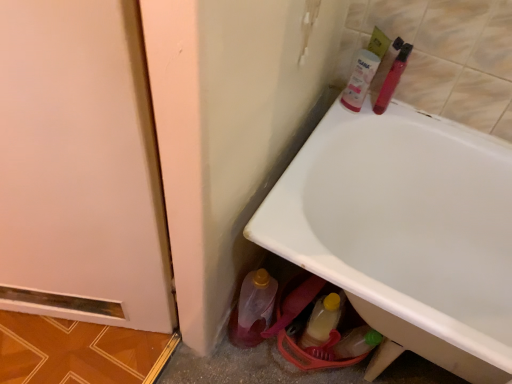
Question: Can you confirm if translucent plastic bottle at lower center, the second bottle viewed from the right, is smaller than translucent plastic tube at upper right, which ranks as the first mouthwash in right-to-left order?

Choices:
 (A) yes
 (B) no

Answer: (B)

Question: Can you confirm if translucent plastic bottle at lower center, which is counted as the first bottle, starting from the left, is shorter than translucent plastic tube at upper right, which ranks as the first mouthwash in right-to-left order?

Choices:
 (A) no
 (B) yes

Answer: (A)

Question: From the image's perspective, is translucent plastic bottle at lower center, the second bottle viewed from the right, over translucent plastic tube at upper right, which ranks as the first mouthwash in right-to-left order?

Choices:
 (A) no
 (B) yes

Answer: (A)

Question: Is translucent plastic bottle at lower center, which is counted as the first bottle, starting from the left, positioned far away from translucent plastic tube at upper right, which is the second mouthwash from left to right?

Choices:
 (A) yes
 (B) no

Answer: (B)

Question: Can you confirm if translucent plastic bottle at lower center, the second bottle viewed from the right, is taller than translucent plastic tube at upper right, which is the second mouthwash from left to right?

Choices:
 (A) no
 (B) yes

Answer: (B)

Question: Is translucent plastic bottle at lower center, the second bottle viewed from the right, with translucent plastic tube at upper right, which ranks as the first mouthwash in right-to-left order?

Choices:
 (A) no
 (B) yes

Answer: (A)

Question: From the image's perspective, does white glossy bathtub at lower right appear higher than translucent plastic bottle at lower center, which is counted as the first bottle, starting from the left?

Choices:
 (A) yes
 (B) no

Answer: (A)

Question: Is white glossy bathtub at lower right next to translucent plastic bottle at lower center, which is counted as the first bottle, starting from the left, and touching it?

Choices:
 (A) yes
 (B) no

Answer: (B)

Question: Is white glossy bathtub at lower right smaller than translucent plastic bottle at lower center, which is counted as the first bottle, starting from the left?

Choices:
 (A) no
 (B) yes

Answer: (A)

Question: Is white glossy bathtub at lower right looking in the opposite direction of translucent plastic bottle at lower center, which is counted as the first bottle, starting from the left?

Choices:
 (A) no
 (B) yes

Answer: (A)

Question: Is white glossy bathtub at lower right outside of translucent plastic bottle at lower center, which is counted as the first bottle, starting from the left?

Choices:
 (A) yes
 (B) no

Answer: (A)

Question: Does white glossy bathtub at lower right have a lesser height compared to translucent plastic bottle at lower center, the second bottle viewed from the right?

Choices:
 (A) no
 (B) yes

Answer: (A)

Question: Is pink plastic tube at upper right, acting as the first mouthwash starting from the left, completely or partially outside of translucent plastic tube at upper right, which is the second mouthwash from left to right?

Choices:
 (A) yes
 (B) no

Answer: (A)